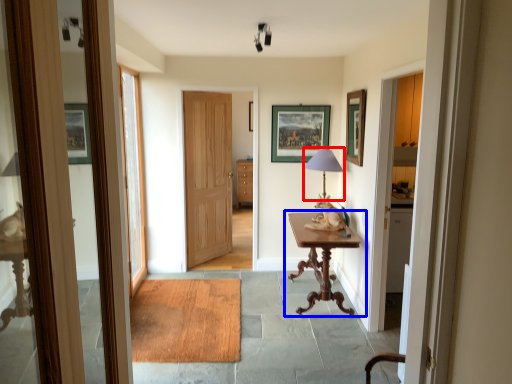
Question: Which of the following is the closest to the observer, table lamp (highlighted by a red box) or table (highlighted by a blue box)?

Choices:
 (A) table lamp
 (B) table

Answer: (B)